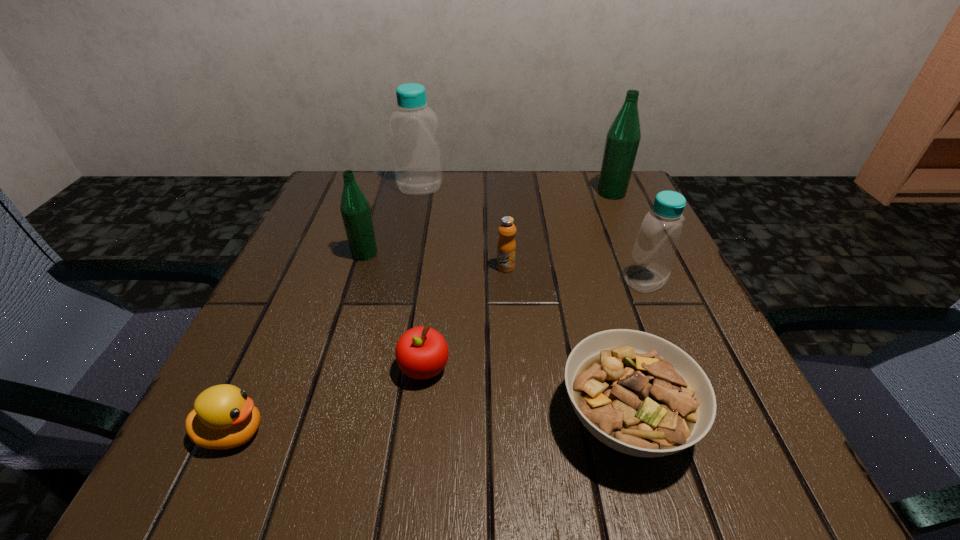
Where is `vacant area between the right blue bottle and the farther green bottle`? The height and width of the screenshot is (540, 960). vacant area between the right blue bottle and the farther green bottle is located at coordinates (629, 237).

This screenshot has height=540, width=960. What are the coordinates of `free space between the smaller blue bottle and the farther green bottle` in the screenshot? It's located at (629, 237).

Identify the location of vacant area that lies between the stew and the orange juice. (565, 343).

You are a GUI agent. You are given a task and a screenshot of the screen. Output one action in this format:
    pyautogui.click(x=<x>, y=<y>)
    Task: Click on the free spot between the fifth tallest object and the red apple
    The image size is (960, 540).
    Given the screenshot: What is the action you would take?
    pyautogui.click(x=465, y=318)

At what (x,y) coordinates should I click in order to perform the action: click on free space between the third farthest bottle and the duckling. Please return your answer as a coordinate pair (x, y). Image resolution: width=960 pixels, height=540 pixels. Looking at the image, I should click on (299, 343).

Locate which object is the seventh closest to the farther green bottle. Please provide its 2D coordinates. Your answer should be formatted as a tuple, i.e. [(x, y)], where the tuple contains the x and y coordinates of a point satisfying the conditions above.

[(224, 417)]

Find the location of a particular element. The width and height of the screenshot is (960, 540). object that is the fourth closest to the bigger green bottle is located at coordinates (639, 394).

Identify which bottle is the second nearest to the nearer green bottle. Please provide its 2D coordinates. Your answer should be formatted as a tuple, i.e. [(x, y)], where the tuple contains the x and y coordinates of a point satisfying the conditions above.

[(656, 244)]

Find the location of `bottle that stands as the fourth closest to the apple`. bottle that stands as the fourth closest to the apple is located at coordinates (623, 138).

Identify the location of free space in the image that satisfies the following two spatial constraints: 1. on the front label of the stew; 2. on the right side of the orange juice. The width and height of the screenshot is (960, 540). coord(516,418).